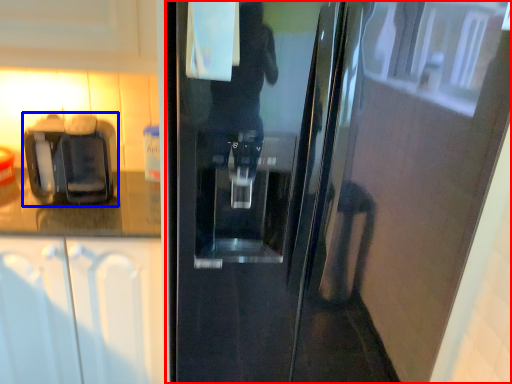
Question: Which object appears farthest to the camera in this image, door (highlighted by a red box) or coffee machine (highlighted by a blue box)?

Choices:
 (A) door
 (B) coffee machine

Answer: (B)